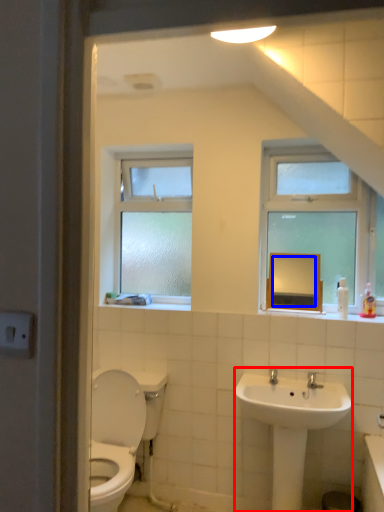
Question: Which of the following is the closest to the observer, sink (highlighted by a red box) or mirror (highlighted by a blue box)?

Choices:
 (A) sink
 (B) mirror

Answer: (A)